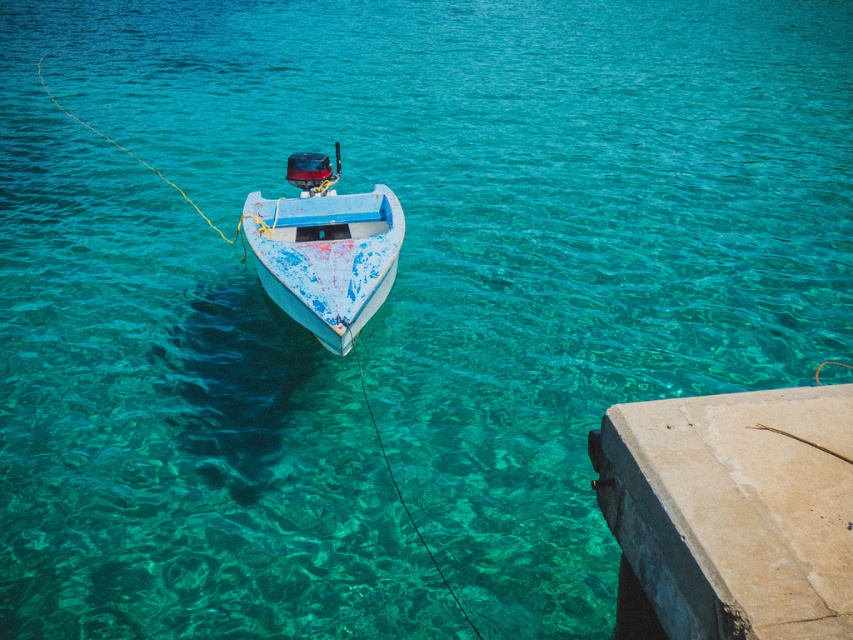
Question: Is concrete at lower right to the left of painted wood boat at center from the viewer's perspective?

Choices:
 (A) no
 (B) yes

Answer: (A)

Question: Is concrete at lower right to the left of painted wood boat at center from the viewer's perspective?

Choices:
 (A) yes
 (B) no

Answer: (B)

Question: Is concrete at lower right behind painted wood boat at center?

Choices:
 (A) no
 (B) yes

Answer: (A)

Question: Which of the following is the farthest from the observer?

Choices:
 (A) (782, 502)
 (B) (334, 296)

Answer: (B)

Question: Which point appears closest to the camera in this image?

Choices:
 (A) [370, 305]
 (B) [775, 620]

Answer: (B)